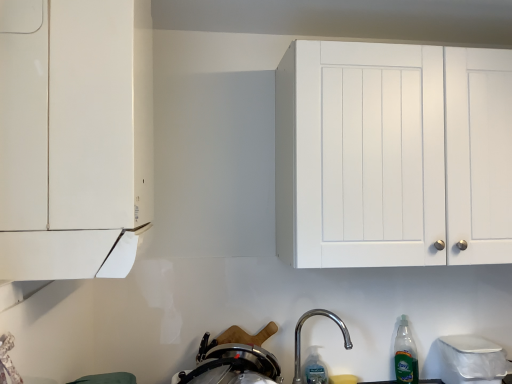
Question: Considering the positions of point (397, 332) and point (243, 332), is point (397, 332) closer or farther from the camera than point (243, 332)?

Choices:
 (A) farther
 (B) closer

Answer: (A)

Question: From a real-world perspective, is green translucent bottle at lower right, which is counted as the first bottle, starting from the right, above or below stainless steel pot at lower center?

Choices:
 (A) below
 (B) above

Answer: (A)

Question: Which is nearer to the green translucent bottle at lower right, which is counted as the first bottle, starting from the right?

Choices:
 (A) polished metallic faucet at lower center
 (B) clear plastic bottle at lower center, which appears as the 1th bottle when viewed from the left
 (C) white matte cabinet at left, marked as the first cabinetry in a left-to-right arrangement
 (D) stainless steel pot at lower center
 (E) white matte cabinet at upper right, which appears as the first cabinetry when viewed from the back

Answer: (A)

Question: Based on their relative distances, which object is nearer to the white matte cabinet at left, marked as the 1th cabinetry in a front-to-back arrangement?

Choices:
 (A) stainless steel pot at lower center
 (B) clear plastic bottle at lower center, positioned as the second bottle in right-to-left order
 (C) white matte cabinet at upper right, which appears as the first cabinetry when viewed from the back
 (D) polished metallic faucet at lower center
 (E) green translucent bottle at lower right, the second bottle viewed from the left

Answer: (A)